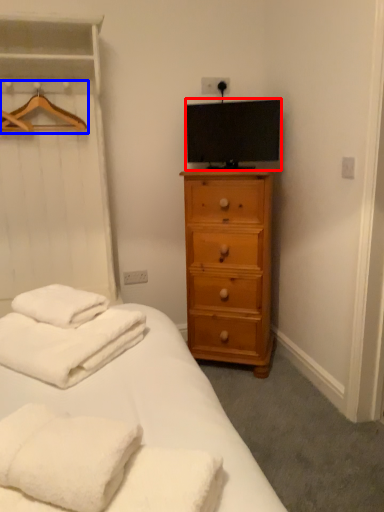
Question: Which point is further to the camera, television (highlighted by a red box) or hanger (highlighted by a blue box)?

Choices:
 (A) television
 (B) hanger

Answer: (A)